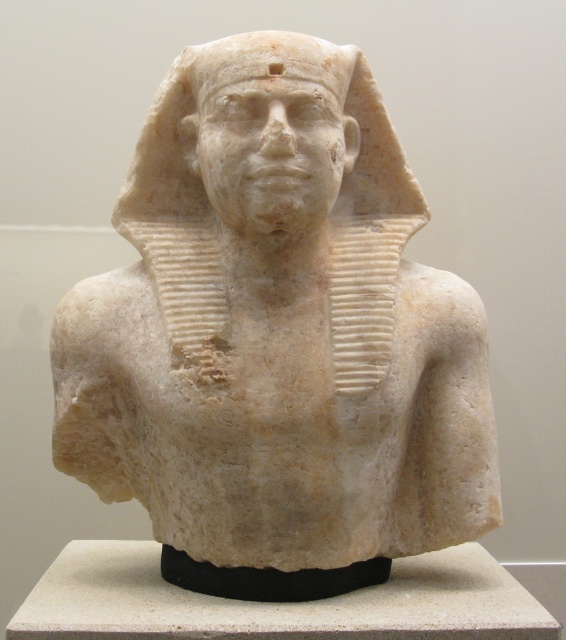
Question: Can you confirm if white marble bust at center is positioned to the left of white marble head at center?

Choices:
 (A) yes
 (B) no

Answer: (B)

Question: Which point is closer to the camera?

Choices:
 (A) (182, 156)
 (B) (311, 275)

Answer: (B)

Question: In this image, where is white marble bust at center located relative to white marble head at center?

Choices:
 (A) above
 (B) below

Answer: (B)

Question: Which point is farther to the camera?

Choices:
 (A) white marble bust at center
 (B) white marble head at center

Answer: (A)

Question: Can you confirm if white marble bust at center is positioned to the right of white marble head at center?

Choices:
 (A) yes
 (B) no

Answer: (A)

Question: Which point is farther to the camera?

Choices:
 (A) (301, 68)
 (B) (62, 460)

Answer: (B)